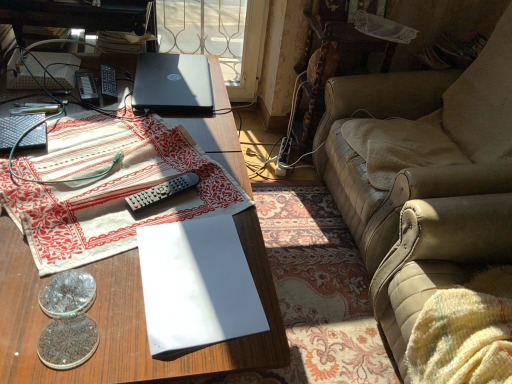
At what (x,y) coordinates should I click in order to perform the action: click on spots to the right of gray plastic remote at center, which ranks as the first remote control in right-to-left order. Please return your answer as a coordinate pair (x, y). Image resolution: width=512 pixels, height=384 pixels. Looking at the image, I should click on (219, 204).